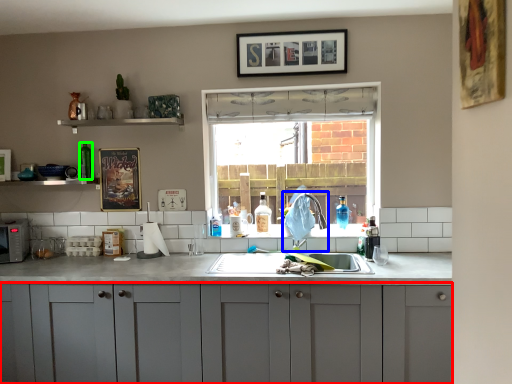
Question: Considering the real-world distances, which object is farthest from cabinetry (highlighted by a red box)? faucet (highlighted by a blue box) or bottle (highlighted by a green box)?

Choices:
 (A) faucet
 (B) bottle

Answer: (B)